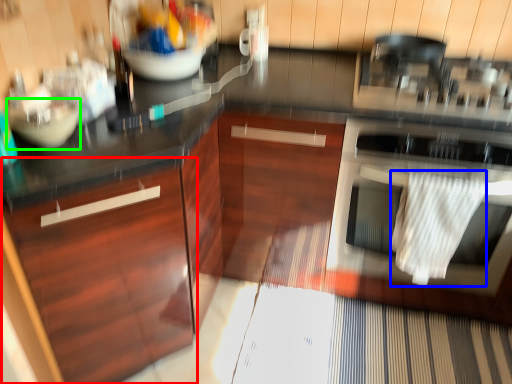
Question: Which object is positioned farthest from cabinetry (highlighted by a red box)? Select from material (highlighted by a blue box) and mixing bowl (highlighted by a green box).

Choices:
 (A) material
 (B) mixing bowl

Answer: (A)